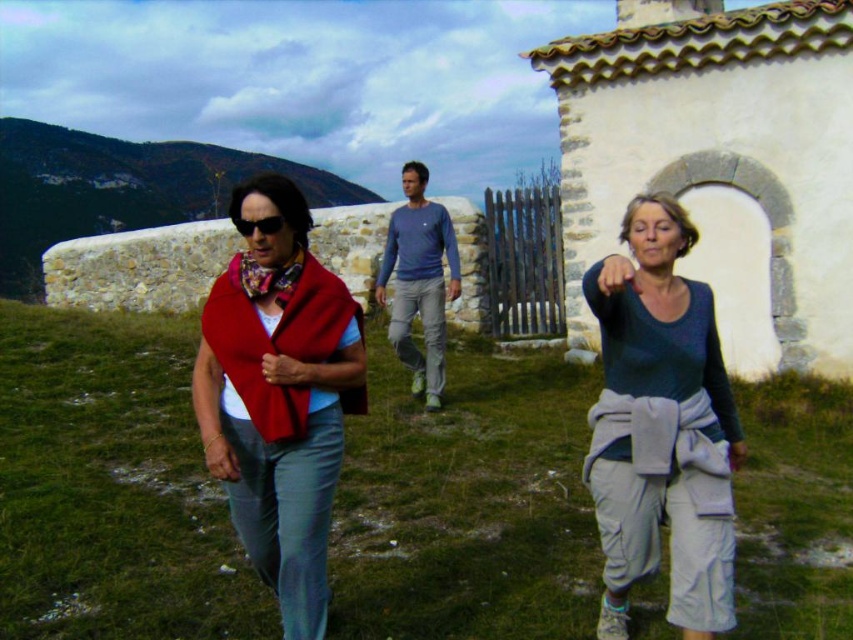
Which of these two, teal matte shirt at center or matte red shawl at center, stands taller?

teal matte shirt at center

Does teal matte shirt at center appear under matte red shawl at center?

Yes, teal matte shirt at center is below matte red shawl at center.

Who is more forward, (622, 323) or (270, 410)?

Point (270, 410)

Find the location of a particular element. teal matte shirt at center is located at coordinates (660, 428).

Which of these two, matte red shawl at center or floral silk scarf at center, stands shorter?

Standing shorter between the two is floral silk scarf at center.

Who is positioned more to the left, matte red shawl at center or floral silk scarf at center?

floral silk scarf at center is more to the left.

Which is in front, point (270, 349) or point (250, 285)?

Point (270, 349) is more forward.

At what (x,y) coordinates should I click in order to perform the action: click on matte red shawl at center. Please return your answer as a coordinate pair (x, y). The image size is (853, 640). Looking at the image, I should click on (276, 340).

Does point (230, 296) lie behind point (666, 276)?

Yes, point (230, 296) is farther from viewer.

Who is more distant from viewer, (343, 410) or (727, 604)?

The point (343, 410) is more distant.

You are a GUI agent. You are given a task and a screenshot of the screen. Output one action in this format:
    pyautogui.click(x=<x>, y=<y>)
    Task: Click on the matte red shawl at left
    
    Given the screenshot: What is the action you would take?
    pyautogui.click(x=280, y=404)